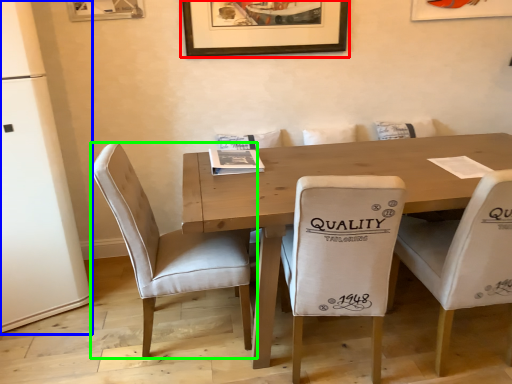
Question: Considering the real-world distances, which object is farthest from picture frame (highlighted by a red box)? fridge (highlighted by a blue box) or chair (highlighted by a green box)?

Choices:
 (A) fridge
 (B) chair

Answer: (A)